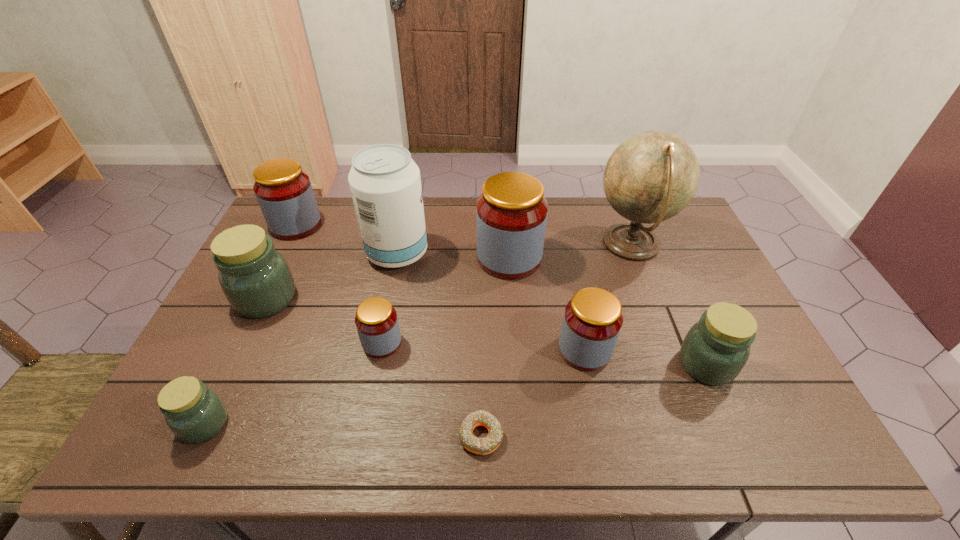
Locate an element on the screen. The width and height of the screenshot is (960, 540). jar located in the near edge section of the desktop is located at coordinates (194, 413).

The width and height of the screenshot is (960, 540). What are the coordinates of `doughnut present at the near edge` in the screenshot? It's located at (482, 446).

Identify the location of globe at the right edge. (652, 176).

This screenshot has width=960, height=540. In order to click on jar at the right edge in this screenshot , I will do `click(716, 348)`.

The width and height of the screenshot is (960, 540). In order to click on object that is at the far left corner in this screenshot , I will do `click(284, 192)`.

Find the location of a particular element. The width and height of the screenshot is (960, 540). object present at the near left corner is located at coordinates (194, 413).

Identify the location of object located at the far right corner. (652, 176).

Locate an element on the screen. The width and height of the screenshot is (960, 540). free space at the far edge of the desktop is located at coordinates (624, 218).

You are a GUI agent. You are given a task and a screenshot of the screen. Output one action in this format:
    pyautogui.click(x=<x>, y=<y>)
    Task: Click on the free space at the near edge
    
    Given the screenshot: What is the action you would take?
    pyautogui.click(x=512, y=454)

At what (x,y) coordinates should I click in order to perform the action: click on vacant space at the left edge of the desktop. Please return your answer as a coordinate pair (x, y). Looking at the image, I should click on tap(225, 398).